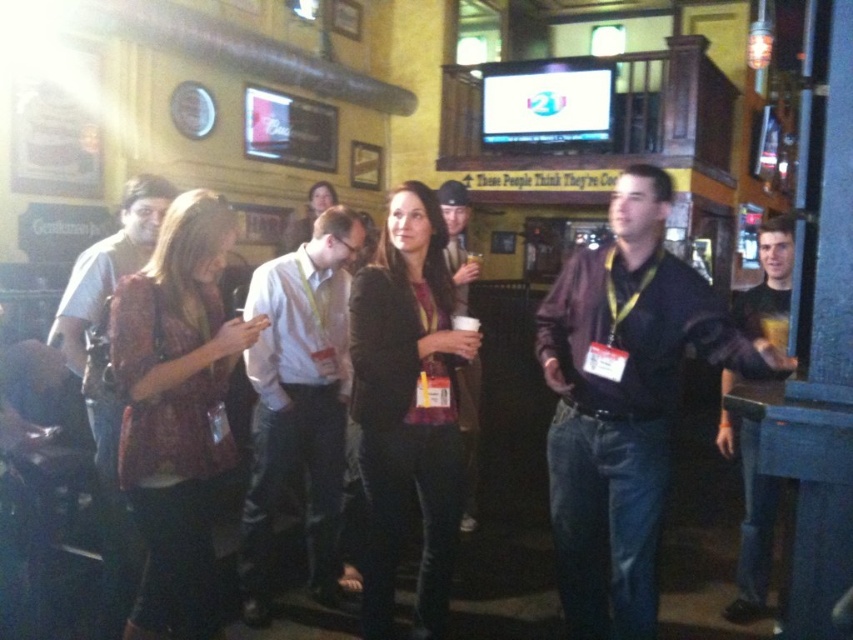
Based on the photo, you are a photographer at the event and need to capture a group photo. The dark brown shirt at center and the white shirt at center are in the frame. Which person should you adjust to ensure both are fully visible? Explain your reasoning.

The dark brown shirt at center has a greater width than the white shirt at center. To ensure both are fully visible in the photo, you should adjust the camera angle or frame to accommodate the wider dark brown shirt at center, ensuring there is enough space for both individuals.

You are a photographer at the event and need to capture a photo of both the dark brown shirt at center and the white shirt at center. Since the people are standing close together, will you need to adjust your camera angle to include both in the frame?

The dark brown shirt at center is not as tall as white shirt at center, so you can position the camera slightly lower to ensure both are visible without needing a wide angle. The height difference allows for a single frame to capture both individuals.

You are a photographer at the event and need to capture a photo that includes both the matte brown shirt at left and the black leather jacket at right. Which object should you focus on first to ensure both are in the frame?

You should focus on the matte brown shirt at left first because it is in front of the black leather jacket at right, ensuring both will be captured in the frame.